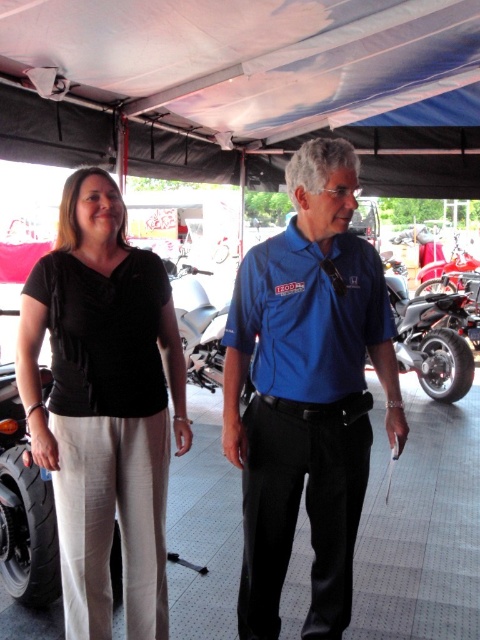
Is point (331, 332) closer to camera compared to point (24, 524)?

That is True.

Is the position of blue shirt at center more distant than that of black rubber tire at lower left?

No, it is in front of black rubber tire at lower left.

Locate an element on the screen. This screenshot has height=640, width=480. blue shirt at center is located at coordinates (307, 392).

Can you confirm if black fabric shirt at left is taller than black rubber tire at lower left?

Yes, black fabric shirt at left is taller than black rubber tire at lower left.

Who is more distant from viewer, [35,454] or [0,540]?

Point [0,540]

Locate an element on the screen. The width and height of the screenshot is (480, 640). black fabric shirt at left is located at coordinates (104, 406).

Is point (261, 600) farther from camera compared to point (87, 436)?

That is True.

Is black matte shirt at center to the left of black fabric shirt at left from the viewer's perspective?

No, black matte shirt at center is not to the left of black fabric shirt at left.

Is point (265, 547) positioned in front of point (98, 595)?

No, (265, 547) is further to viewer.

Find the location of a particular element. This screenshot has width=480, height=640. black matte shirt at center is located at coordinates (307, 392).